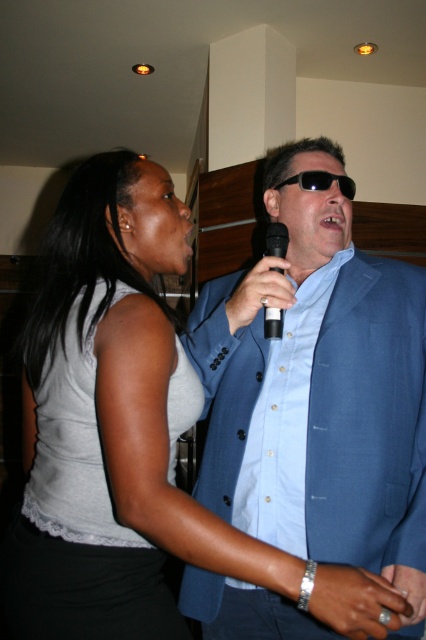
Question: Which point is farther to the camera?

Choices:
 (A) (23, 532)
 (B) (288, 180)
 (C) (271, 316)
 (D) (221, 310)

Answer: (B)

Question: Which point appears farthest from the camera in this image?

Choices:
 (A) (270, 323)
 (B) (319, 170)
 (C) (388, 513)
 (D) (172, 636)

Answer: (B)

Question: Does gray lace tank top at upper left come behind black plastic microphone at center?

Choices:
 (A) yes
 (B) no

Answer: (B)

Question: Observing the image, what is the correct spatial positioning of blue fabric suit at center in reference to gray lace tank top at upper left?

Choices:
 (A) left
 (B) right

Answer: (B)

Question: Is blue fabric suit at center bigger than black plastic sunglasses at center?

Choices:
 (A) yes
 (B) no

Answer: (A)

Question: Estimate the real-world distances between objects in this image. Which object is farther from the black plastic microphone at center?

Choices:
 (A) blue fabric suit at center
 (B) black plastic sunglasses at center

Answer: (A)